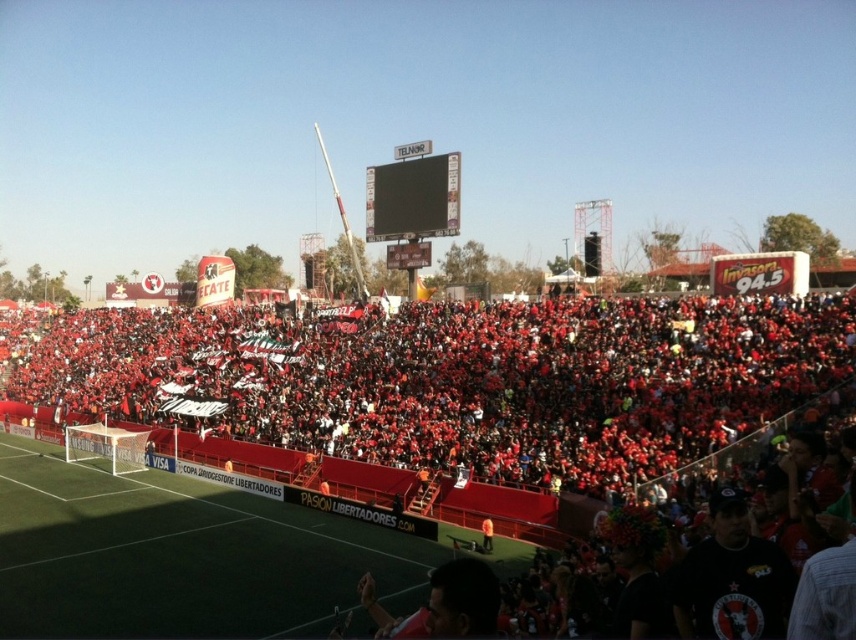
Question: Is black matte shirt at lower right smaller than black glossy scoreboard at center?

Choices:
 (A) yes
 (B) no

Answer: (A)

Question: Which point is closer to the camera?

Choices:
 (A) (672, 372)
 (B) (378, 195)
 (C) (490, 524)
 (D) (450, 568)

Answer: (D)

Question: Is black matte shirt at lower right thinner than matte black shirt at lower center?

Choices:
 (A) no
 (B) yes

Answer: (B)

Question: Which object is farther from the camera taking this photo?

Choices:
 (A) orange fabric person at lower center
 (B) black matte shirt at lower right
 (C) matte black shirt at lower center
 (D) black glossy scoreboard at center

Answer: (D)

Question: Which of the following is the closest to the observer?

Choices:
 (A) (435, 176)
 (B) (426, 605)
 (C) (485, 529)

Answer: (B)

Question: Is matte black shirt at lower center behind orange fabric person at lower center?

Choices:
 (A) no
 (B) yes

Answer: (A)